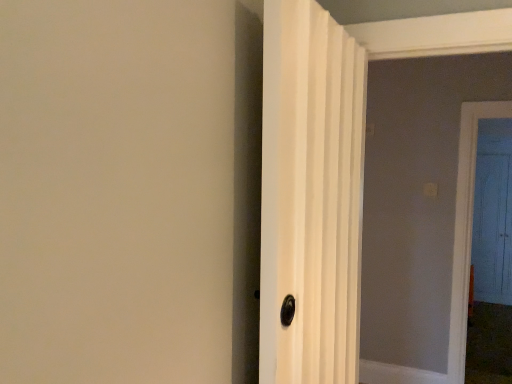
Question: In the image, is white textured door at center, which is the second door from back to front, positioned in front of or behind blue wooden door at right, which is counted as the 1th door, starting from the right?

Choices:
 (A) behind
 (B) front

Answer: (B)

Question: In terms of width, does white textured door at center, which is the second door from back to front, look wider or thinner when compared to blue wooden door at right, which is the second door in front-to-back order?

Choices:
 (A) wide
 (B) thin

Answer: (A)

Question: From their relative heights in the image, would you say white textured door at center, which ranks as the first door in front-to-back order, is taller or shorter than blue wooden door at right, acting as the 2th door starting from the left?

Choices:
 (A) short
 (B) tall

Answer: (A)

Question: From their relative heights in the image, would you say blue wooden door at right, marked as the first door in a back-to-front arrangement, is taller or shorter than white textured door at center, which is the second door from back to front?

Choices:
 (A) tall
 (B) short

Answer: (A)

Question: In terms of size, does blue wooden door at right, which is the second door in front-to-back order, appear bigger or smaller than white textured door at center, which ranks as the first door in left-to-right order?

Choices:
 (A) big
 (B) small

Answer: (B)

Question: Is point tap(474, 243) positioned closer to the camera than point tap(293, 256)?

Choices:
 (A) farther
 (B) closer

Answer: (A)

Question: In the image, is blue wooden door at right, which is the second door in front-to-back order, positioned in front of or behind white textured door at center, which ranks as the first door in front-to-back order?

Choices:
 (A) front
 (B) behind

Answer: (B)